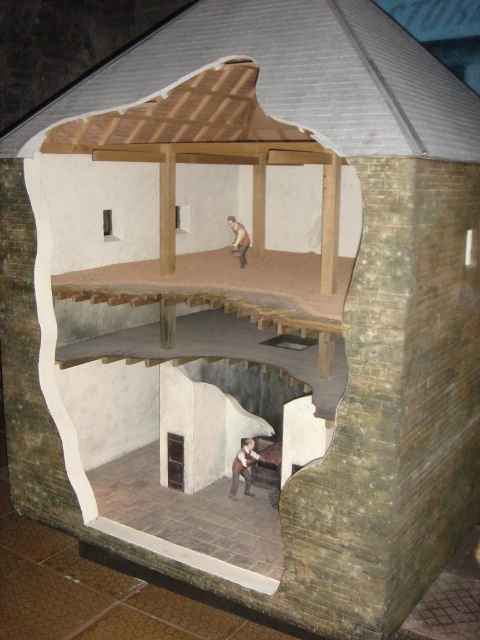
You are examining the architectural model and want to determine the spatial relationship between two points. Which of the two points, point (x=168, y=472) or point (x=240, y=243), is closer to your viewpoint?

Point (x=168, y=472) is closer to the camera than point (x=240, y=243).